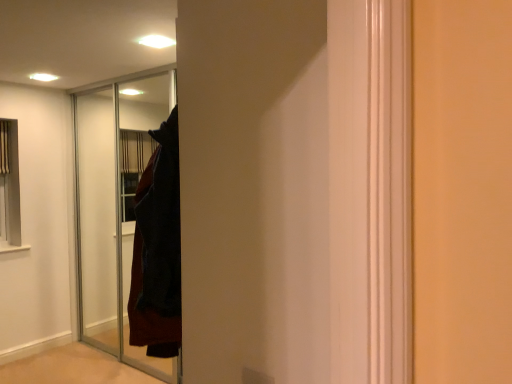
Where is `dark woolen coat at center`? This screenshot has height=384, width=512. dark woolen coat at center is located at coordinates (158, 249).

What do you see at coordinates (158, 249) in the screenshot? The height and width of the screenshot is (384, 512). I see `dark woolen coat at center` at bounding box center [158, 249].

Where is `dark woolen coat at center`? This screenshot has height=384, width=512. dark woolen coat at center is located at coordinates (158, 249).